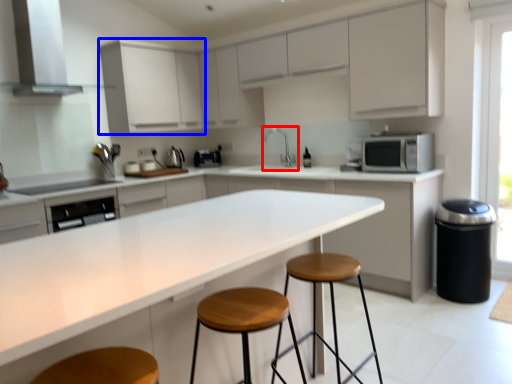
Question: Which of the following is the farthest to the observer, sink (highlighted by a red box) or cabinetry (highlighted by a blue box)?

Choices:
 (A) sink
 (B) cabinetry

Answer: (A)